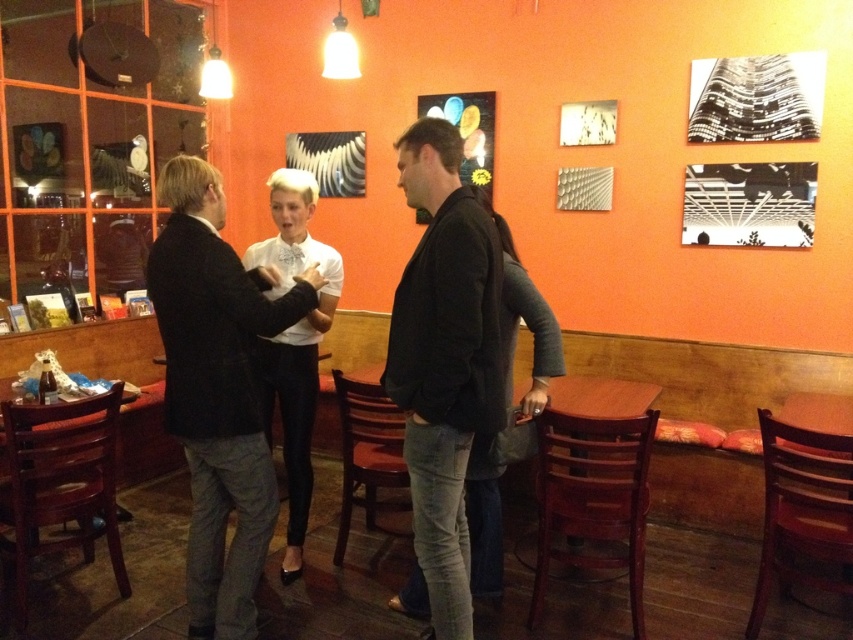
Question: Can you confirm if dark gray suit at center is positioned to the left of wooden table at center?

Choices:
 (A) yes
 (B) no

Answer: (A)

Question: Can you confirm if black matte jacket at center is thinner than white shirt at center?

Choices:
 (A) yes
 (B) no

Answer: (A)

Question: Which of the following is the farthest from the observer?

Choices:
 (A) (311, 356)
 (B) (202, 506)
 (C) (590, 412)
 (D) (410, 346)

Answer: (C)

Question: Considering the real-world distances, which object is farthest from the dark gray suit at center?

Choices:
 (A) white shirt at center
 (B) wooden table at center
 (C) black matte jacket at center

Answer: (B)

Question: Which point is farther to the camera?

Choices:
 (A) black matte jacket at center
 (B) dark gray suit at center

Answer: (B)

Question: Can you confirm if white shirt at center is positioned to the right of wooden table at center?

Choices:
 (A) yes
 (B) no

Answer: (B)